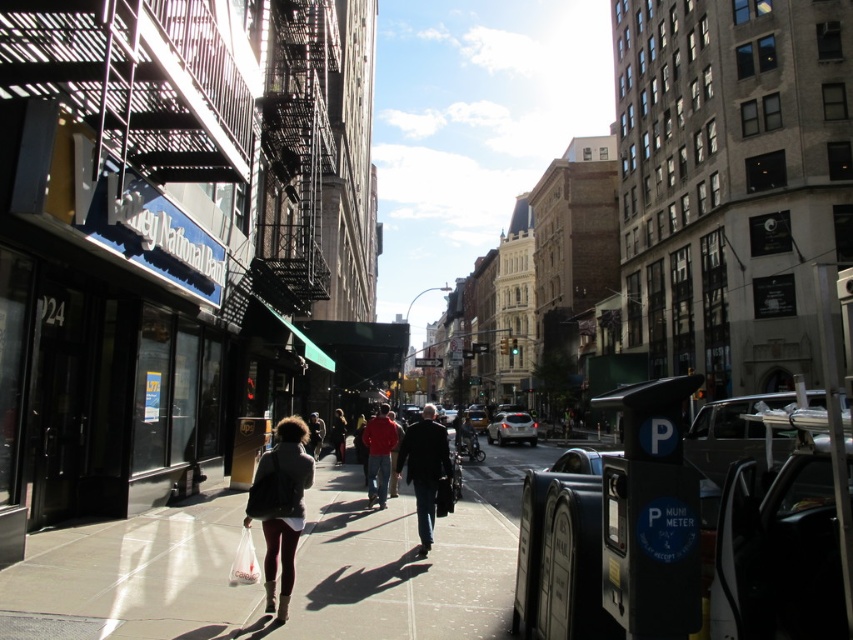
Which is in front, point (248, 531) or point (341, 420)?

Point (248, 531) is more forward.

Does white plastic bag at lower center appear over dark brown leather jacket at center?

Yes.

This screenshot has width=853, height=640. In order to click on white plastic bag at lower center in this screenshot , I will do tap(244, 561).

How much distance is there between smooth concrete sidewalk at center and white plastic bag at lower center?

The distance of smooth concrete sidewalk at center from white plastic bag at lower center is 14.34 feet.

Which is in front, point (354, 515) or point (259, 570)?

Point (259, 570)

The image size is (853, 640). I want to click on smooth concrete sidewalk at center, so click(x=296, y=568).

Can you confirm if dark gray jacket at center is positioned to the right of dark brown leather jacket at center?

Yes, dark gray jacket at center is to the right of dark brown leather jacket at center.

Can you confirm if dark gray jacket at center is wider than dark brown leather jacket at center?

In fact, dark gray jacket at center might be narrower than dark brown leather jacket at center.

Measure the distance between dark gray jacket at center and camera.

dark gray jacket at center and camera are 9.16 meters apart from each other.

The width and height of the screenshot is (853, 640). In order to click on dark gray jacket at center in this screenshot , I will do `click(425, 468)`.